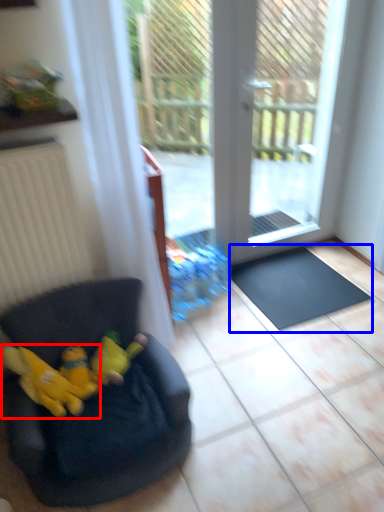
Question: Which object is closer to the camera taking this photo, animal (highlighted by a red box) or doormat (highlighted by a blue box)?

Choices:
 (A) animal
 (B) doormat

Answer: (A)